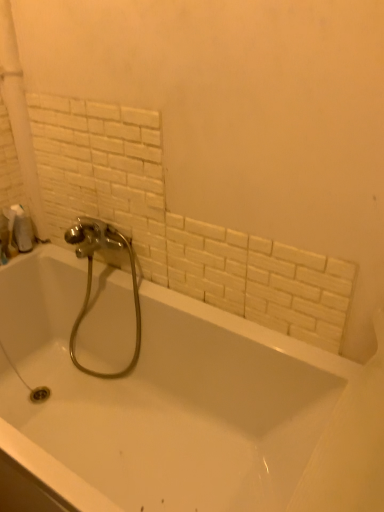
Question: Based on their positions, is chrome metallic faucet at center located to the left or right of white glossy bathtub at center?

Choices:
 (A) left
 (B) right

Answer: (A)

Question: Is point (74, 236) positioned closer to the camera than point (112, 302)?

Choices:
 (A) closer
 (B) farther

Answer: (B)

Question: Estimate the real-world distances between objects in this image. Which object is closer to the white matte toilet paper at left?

Choices:
 (A) chrome metallic faucet at center
 (B) white glossy bathtub at center

Answer: (A)

Question: Which is farther from the white matte toilet paper at left?

Choices:
 (A) white glossy bathtub at center
 (B) chrome metallic faucet at center

Answer: (A)